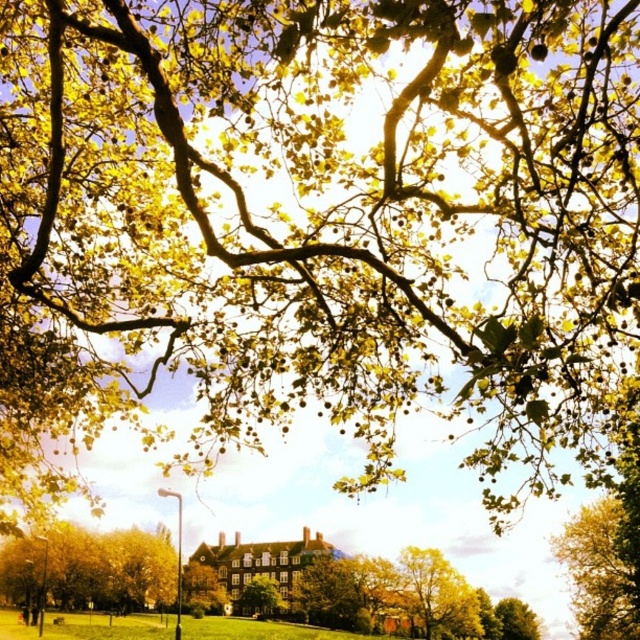
Question: Considering the relative positions of golden textured leaves at lower center and yellow-green leaves at center in the image provided, where is golden textured leaves at lower center located with respect to yellow-green leaves at center?

Choices:
 (A) above
 (B) below

Answer: (A)

Question: Can you confirm if golden leafy tree at upper center is positioned below green leafy tree at lower right?

Choices:
 (A) yes
 (B) no

Answer: (B)

Question: Which of the following is the closest to the observer?

Choices:
 (A) golden textured leaves at lower center
 (B) green leafy tree at lower right
 (C) yellow-green leaves at center
 (D) golden leafy tree at upper center

Answer: (D)

Question: Among these points, which one is nearest to the camera?

Choices:
 (A) click(529, 616)
 (B) click(451, 632)

Answer: (B)

Question: Among these points, which one is nearest to the camera?

Choices:
 (A) (451, 618)
 (B) (618, 595)
 (C) (499, 618)
 (D) (209, 600)

Answer: (B)

Question: Can you confirm if golden textured leaves at lower center is positioned to the left of golden leafy tree at upper center?

Choices:
 (A) no
 (B) yes

Answer: (B)